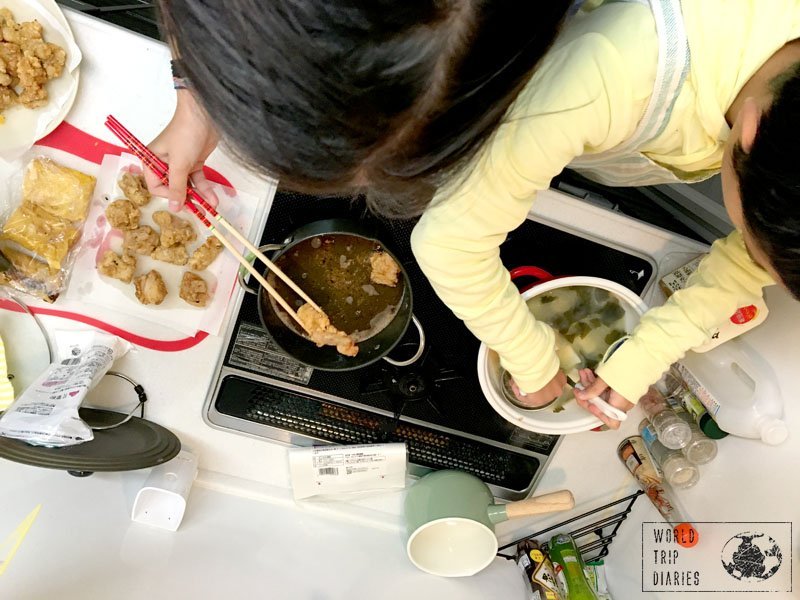
Image resolution: width=800 pixels, height=600 pixels. In order to click on plastic jug in this screenshot , I will do tap(734, 413).